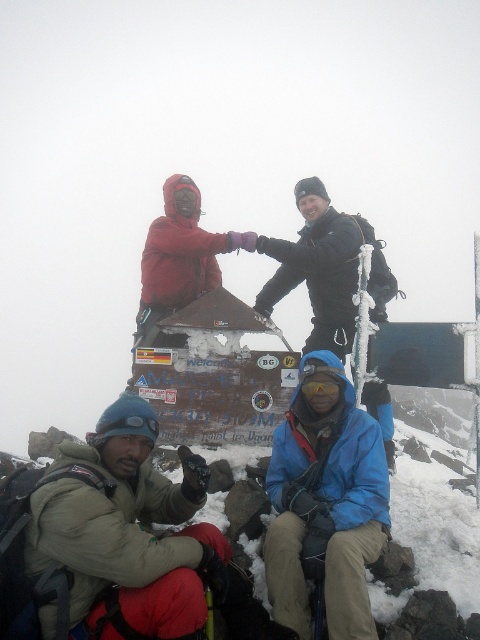
Does beige fleece jacket at lower left come in front of blue softshell jacket at lower right?

Yes.

Who is more forward, (x=148, y=490) or (x=345, y=401)?

Positioned in front is point (x=148, y=490).

Does point (180, 547) come behind point (331, 424)?

No, it is not.

Image resolution: width=480 pixels, height=640 pixels. I want to click on beige fleece jacket at lower left, so click(128, 531).